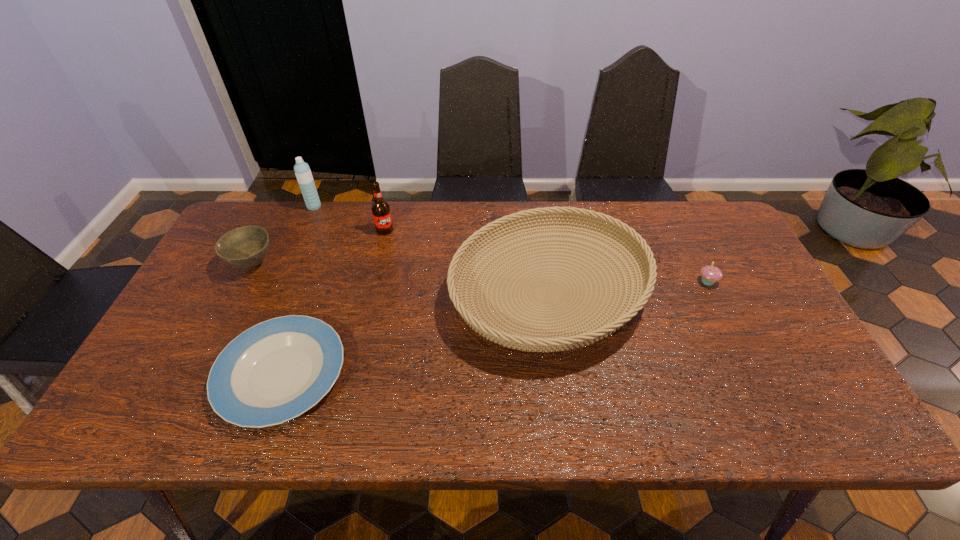
This screenshot has height=540, width=960. Find the location of `object present at the far left corner`. object present at the far left corner is located at coordinates (246, 247).

I want to click on vacant position at the far edge of the desktop, so click(x=323, y=226).

The width and height of the screenshot is (960, 540). In order to click on blank space at the near edge of the desktop in this screenshot , I will do `click(743, 399)`.

Find the location of `blank area at the left edge`. blank area at the left edge is located at coordinates (195, 340).

What are the coordinates of `vacant area at the right edge` in the screenshot? It's located at (751, 287).

Image resolution: width=960 pixels, height=540 pixels. Find the location of `free space at the far left corner of the desktop`. free space at the far left corner of the desktop is located at coordinates (263, 200).

The image size is (960, 540). Identify the location of free space that is in between the water bottle and the root beer. (349, 218).

Locate an element on the screen. This screenshot has width=960, height=540. vacant space that's between the bowl and the plate is located at coordinates (268, 319).

Locate an element on the screen. This screenshot has height=540, width=960. empty space between the shortest object and the second object from right to left is located at coordinates point(416,334).

Locate an element on the screen. The width and height of the screenshot is (960, 540). vacant space that is in between the bowl and the fourth shortest object is located at coordinates (400, 278).